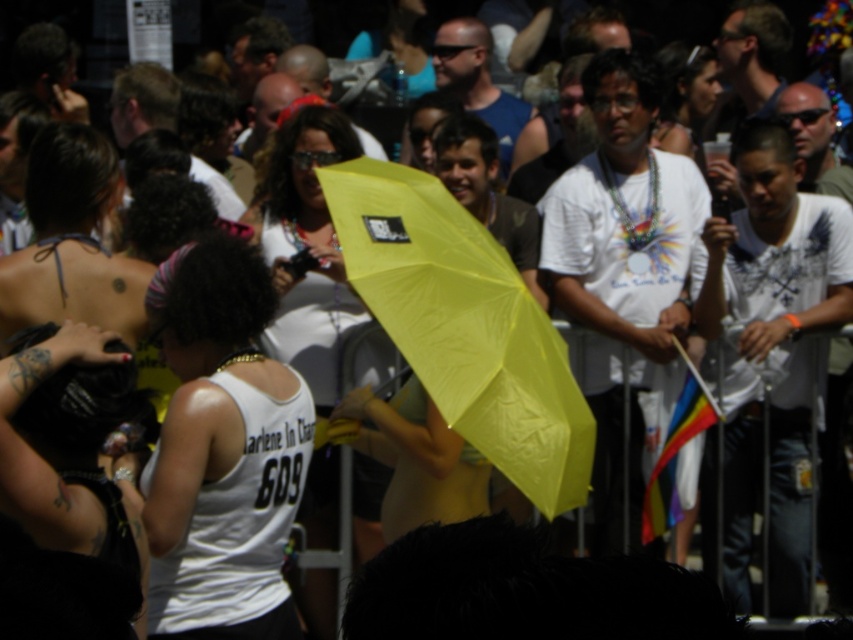
Can you confirm if yellow matte umbrella at center is thinner than matte yellow umbrella at center?

No.

At what (x,y) coordinates should I click in order to perform the action: click on yellow matte umbrella at center. Please return your answer as a coordinate pair (x, y). Looking at the image, I should click on (463, 324).

The image size is (853, 640). What do you see at coordinates (463, 324) in the screenshot? I see `yellow matte umbrella at center` at bounding box center [463, 324].

The width and height of the screenshot is (853, 640). What are the coordinates of `yellow matte umbrella at center` in the screenshot? It's located at (463, 324).

Can you confirm if white matte tank top at center is positioned to the left of yellow matte umbrella at center?

Correct, you'll find white matte tank top at center to the left of yellow matte umbrella at center.

This screenshot has height=640, width=853. I want to click on white matte tank top at center, so [223, 456].

Which is behind, point (242, 260) or point (372, 273)?

Positioned behind is point (372, 273).

Where is `white matte tank top at center`? The height and width of the screenshot is (640, 853). white matte tank top at center is located at coordinates (223, 456).

What do you see at coordinates (223, 456) in the screenshot? The height and width of the screenshot is (640, 853). I see `white matte tank top at center` at bounding box center [223, 456].

Between point (169, 408) and point (318, 499), which one is positioned in front?

Point (169, 408) is more forward.

Is point (177, 582) behind point (322, 307)?

No, it is not.

Find the location of a particular element. white matte tank top at center is located at coordinates (223, 456).